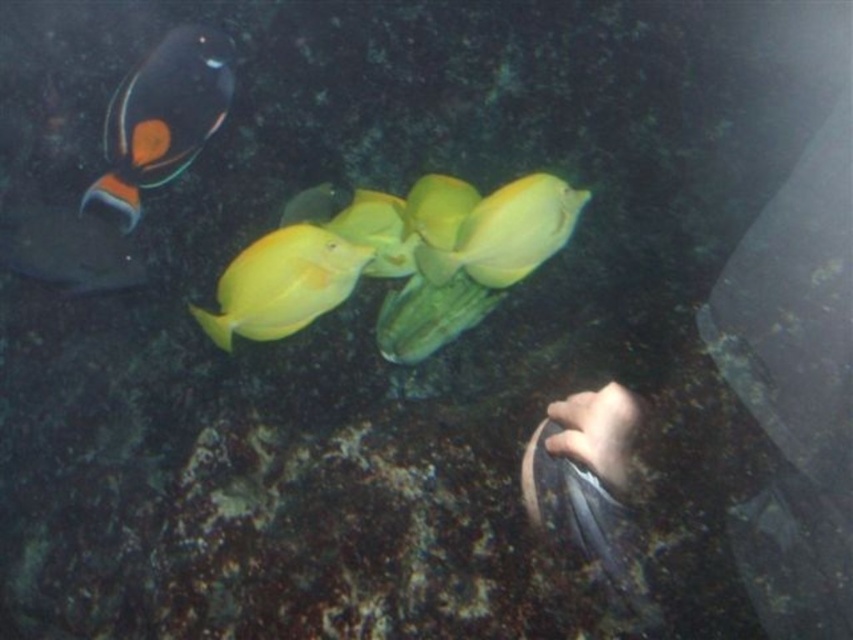
Question: Which point is closer to the camera?

Choices:
 (A) (332, 240)
 (B) (138, 113)

Answer: (A)

Question: Among these points, which one is farthest from the camera?

Choices:
 (A) (105, 236)
 (B) (123, 84)

Answer: (A)

Question: Observing the image, what is the correct spatial positioning of orange and black textured fish at upper left in reference to shiny yellow fish at center?

Choices:
 (A) right
 (B) left

Answer: (B)

Question: Does orange and black textured fish at upper left have a greater width compared to yellow matte fish at center?

Choices:
 (A) yes
 (B) no

Answer: (A)

Question: Is yellow matte fish at center above shiny black fish at left?

Choices:
 (A) yes
 (B) no

Answer: (B)

Question: Estimate the real-world distances between objects in this image. Which object is farther from the orange and black textured fish at upper left?

Choices:
 (A) shiny black fish at left
 (B) yellow matte fish at center
 (C) shiny yellow fish at center

Answer: (B)